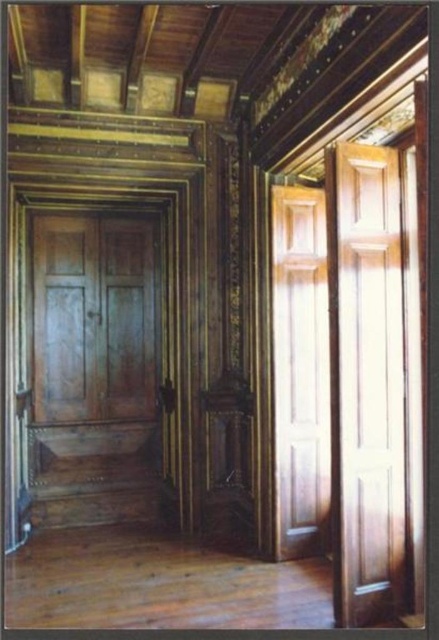
Between glossy wood door at right and wooden paneling at right, which one has more height?

With more height is glossy wood door at right.

Between glossy wood door at right and wooden paneling at right, which one appears on the left side from the viewer's perspective?

wooden paneling at right

Where is `glossy wood door at right`? glossy wood door at right is located at coordinates (366, 384).

At what (x,y) coordinates should I click in order to perform the action: click on glossy wood door at right. Please return your answer as a coordinate pair (x, y). The width and height of the screenshot is (439, 640). Looking at the image, I should click on [366, 384].

Between glossy wood door at right and wooden panelled door at center, which one has less height?

Standing shorter between the two is wooden panelled door at center.

Is glossy wood door at right positioned at the back of wooden panelled door at center?

No, it is in front of wooden panelled door at center.

Measure the distance between point (377, 436) and camera.

11.18 feet

Identify the location of glossy wood door at right. This screenshot has width=439, height=640. (366, 384).

Looking at this image, is wooden panelled door at center bigger than wooden paneling at right?

Indeed, wooden panelled door at center has a larger size compared to wooden paneling at right.

Does point (89, 225) come closer to viewer compared to point (320, 467)?

No, (89, 225) is further to viewer.

Does point (63, 397) lie behind point (303, 189)?

Yes, it is.

At what (x,y) coordinates should I click in order to perform the action: click on wooden panelled door at center. Please return your answer as a coordinate pair (x, y). This screenshot has width=439, height=640. Looking at the image, I should click on (93, 317).